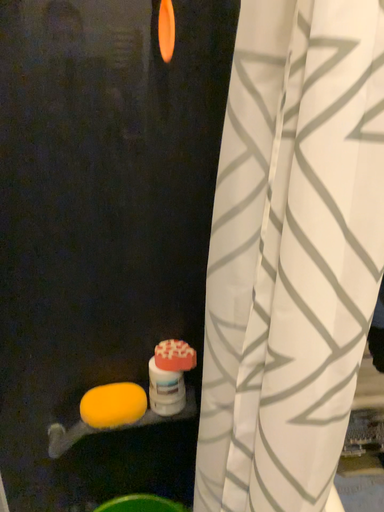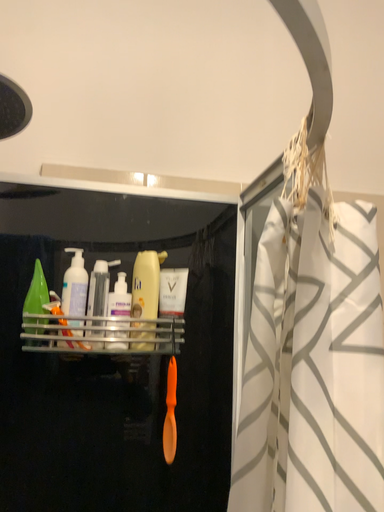
Question: How did the camera likely rotate when shooting the video?

Choices:
 (A) rotated downward
 (B) rotated upward

Answer: (B)